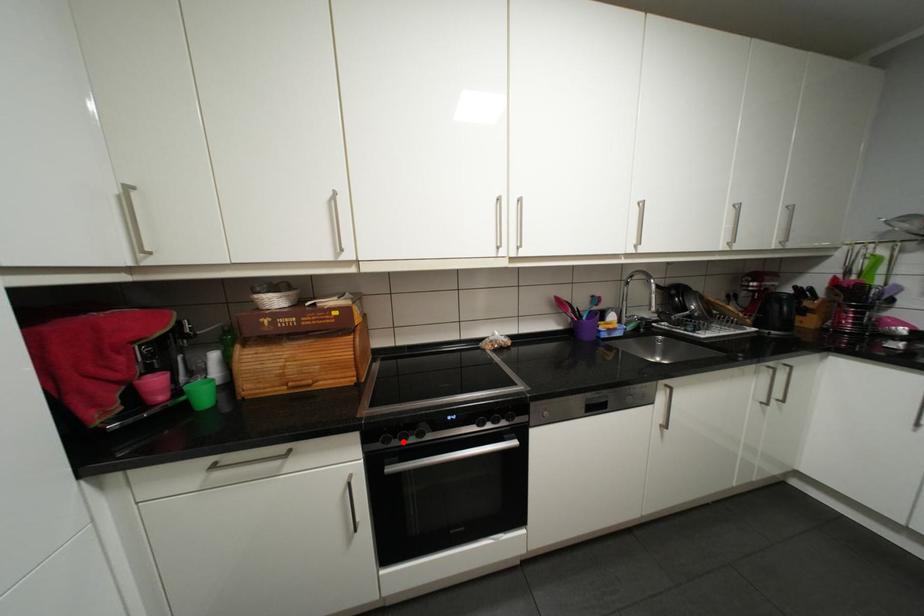
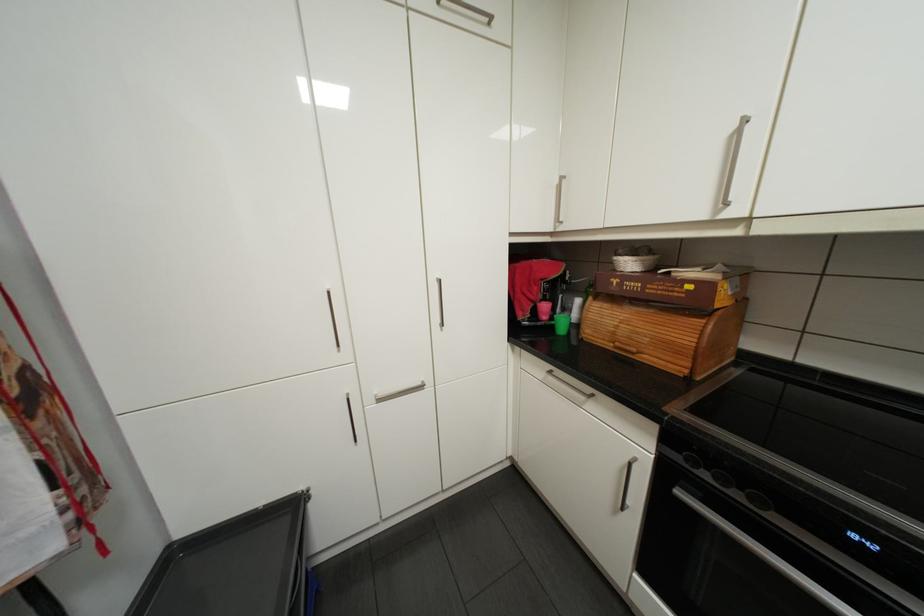
Question: I am providing you with two images of the same scene from different viewpoints. Image1 has a red point marked. In image2, the corresponding 3D location appears at what relative position? Reply with the corresponding letter.

Choices:
 (A) Closer
 (B) Farther

Answer: (A)